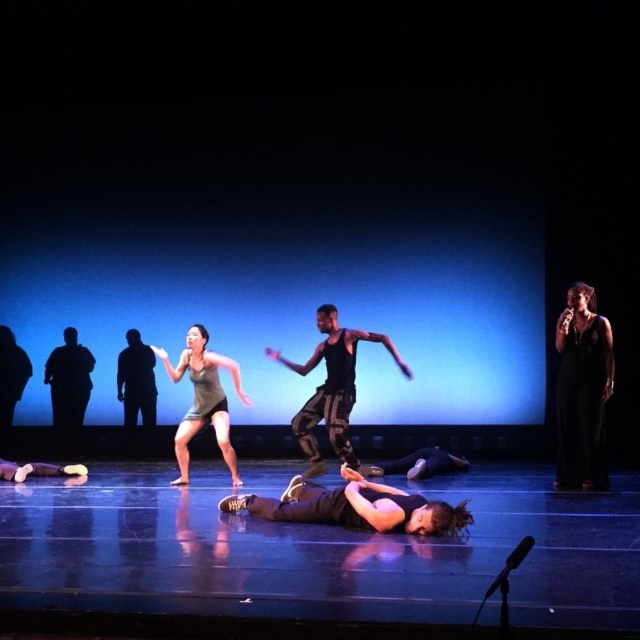
Question: Is black mesh tank top at center bigger than black matte figure at left?

Choices:
 (A) no
 (B) yes

Answer: (B)

Question: Which of these objects is positioned closest to the black mesh tank top at center?

Choices:
 (A) black matte figure at left
 (B) matte gray tank top at center

Answer: (B)

Question: Can you confirm if black satin dress at right is wider than matte gray tank top at center?

Choices:
 (A) yes
 (B) no

Answer: (B)

Question: Can you confirm if black satin dress at right is positioned to the right of matte gray tank top at center?

Choices:
 (A) yes
 (B) no

Answer: (A)

Question: Which object appears closest to the camera in this image?

Choices:
 (A) black mesh tank top at center
 (B) black matte figure at left
 (C) matte gray tank top at center
 (D) black satin dress at right

Answer: (D)

Question: Among these objects, which one is nearest to the camera?

Choices:
 (A) black satin dress at right
 (B) black mesh tank top at center
 (C) black matte figure at left

Answer: (A)